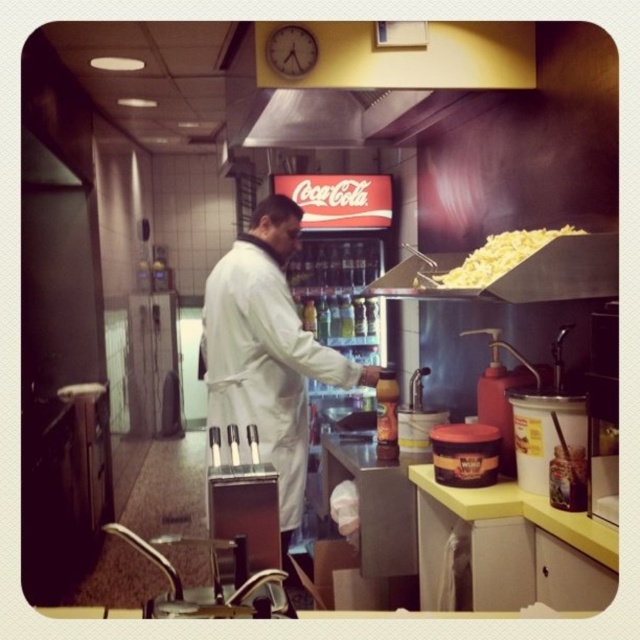
Is the position of white matte coat at center more distant than that of yellow crumbly cheese at upper right?

Yes, white matte coat at center is behind yellow crumbly cheese at upper right.

Between white matte coat at center and yellow crumbly cheese at upper right, which one is positioned lower?

white matte coat at center is lower down.

Between point (244, 417) and point (522, 248), which one is positioned behind?

The point (244, 417) is behind.

This screenshot has width=640, height=640. In order to click on white matte coat at center in this screenshot , I will do `click(268, 353)`.